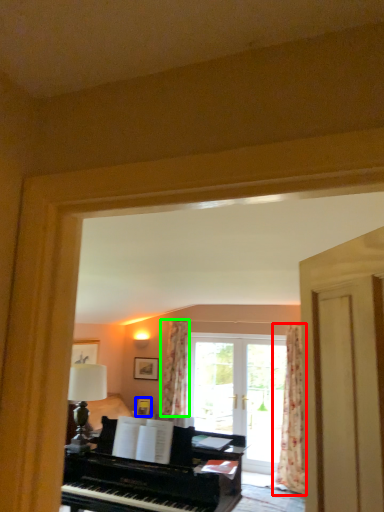
Question: Which object is positioned farthest from curtain (highlighted by a red box)? Select from picture frame (highlighted by a blue box) and curtain (highlighted by a green box).

Choices:
 (A) picture frame
 (B) curtain

Answer: (A)